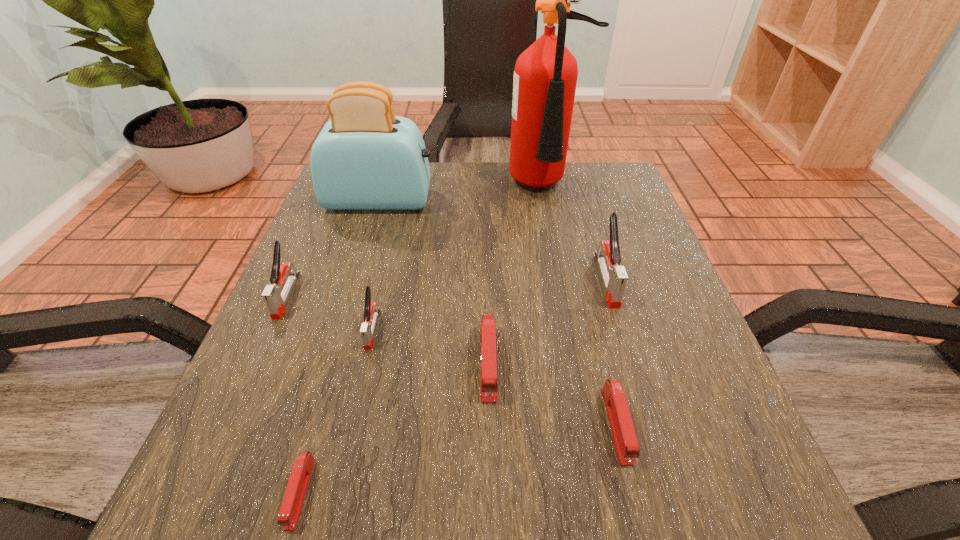
At what (x,y) coordinates should I click in order to perform the action: click on gray stapler that is the third closest to the second red stapler from right to left. Please return your answer as a coordinate pair (x, y). Looking at the image, I should click on (275, 299).

Select which gray stapler is the second closest to the shortest stapler. Please provide its 2D coordinates. Your answer should be formatted as a tuple, i.e. [(x, y)], where the tuple contains the x and y coordinates of a point satisfying the conditions above.

[(275, 299)]

At what (x,y) coordinates should I click in order to perform the action: click on red stapler that is the second closest one to the third shortest object. Please return your answer as a coordinate pair (x, y). Looking at the image, I should click on (291, 506).

The height and width of the screenshot is (540, 960). Find the location of `red stapler that can be found as the third closest to the seventh shortest object`. red stapler that can be found as the third closest to the seventh shortest object is located at coordinates (291, 506).